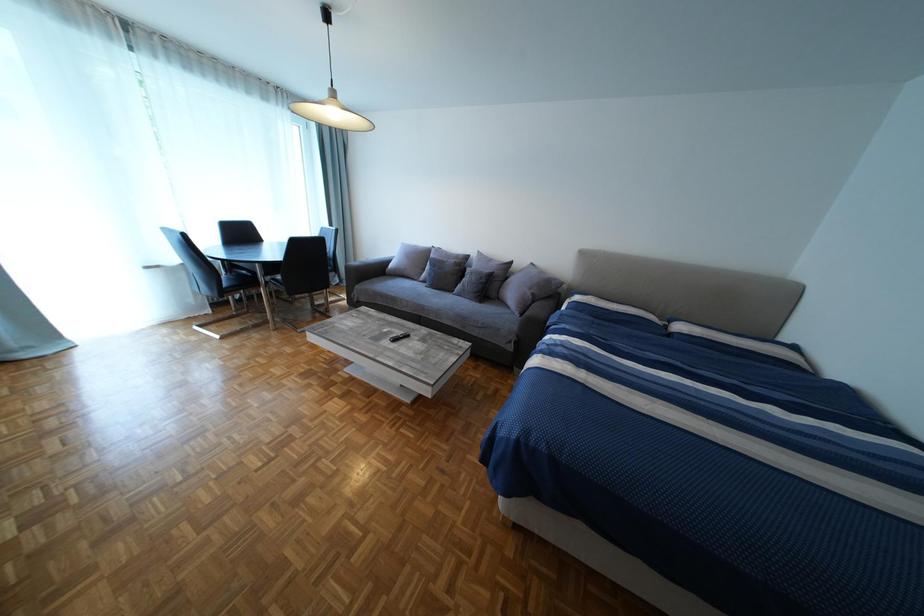
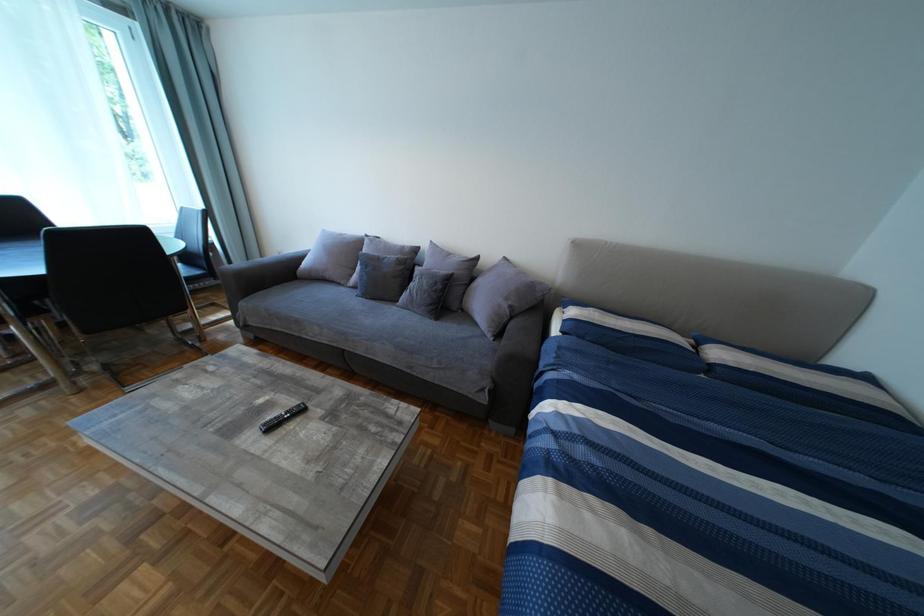
Question: In a continuous first-person perspective shot, in which direction is the camera moving?

Choices:
 (A) Left
 (B) Right
 (C) Forward
 (D) Backward

Answer: (C)